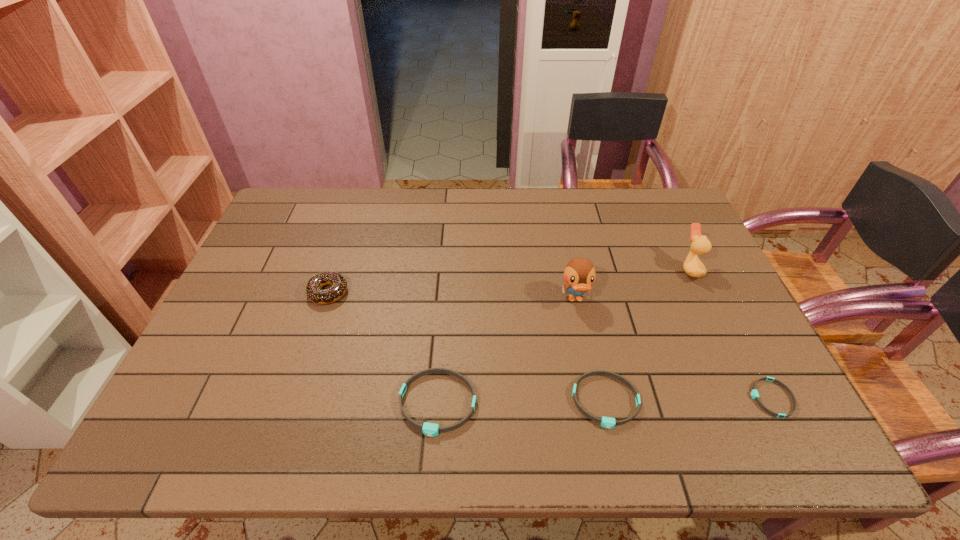
Find the location of a particular element. The image size is (960, 540). the leftmost wristband is located at coordinates (429, 429).

Locate an element on the screen. the second wristband from left to right is located at coordinates (607, 422).

Locate an element on the screen. the second shortest wristband is located at coordinates (607, 422).

Where is `the rightmost wristband`? the rightmost wristband is located at coordinates (754, 393).

Where is `the shortest wristband`? the shortest wristband is located at coordinates (754, 393).

Where is `the fourth shortest object`? Image resolution: width=960 pixels, height=540 pixels. the fourth shortest object is located at coordinates (313, 292).

Locate an element on the screen. The width and height of the screenshot is (960, 540). the leftmost object is located at coordinates [313, 292].

Locate an element on the screen. This screenshot has height=540, width=960. the left duck is located at coordinates (579, 274).

The height and width of the screenshot is (540, 960). Identify the location of the farther duck. (700, 245).

At what (x,y) coordinates should I click in order to perform the action: click on free spot located on the buckle of the shortest object. Please return your answer as a coordinate pair (x, y). Looking at the image, I should click on (577, 398).